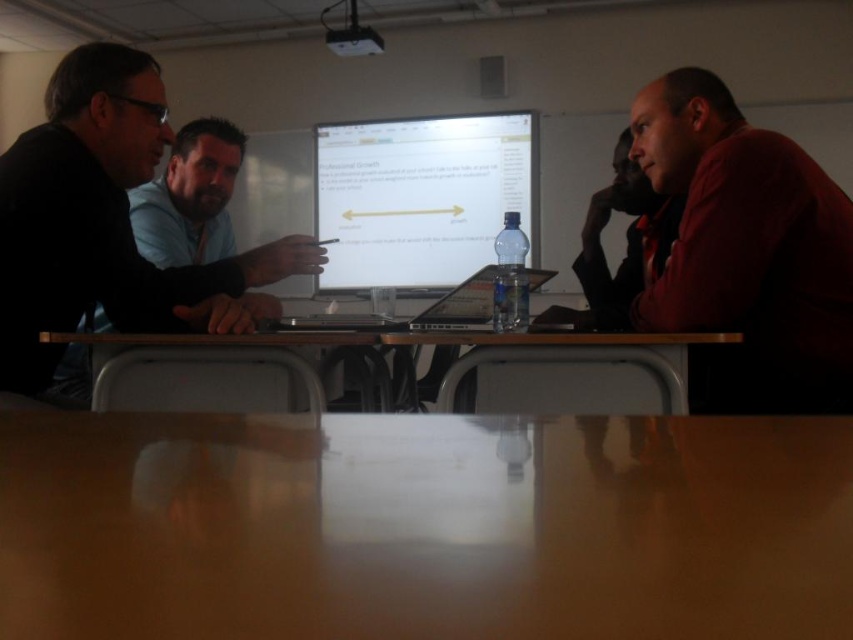
You are sitting at the table and want to reach both the white glossy computer monitor at center and the black plastic laptop at center. Which one is closer to your left side?

The white glossy computer monitor at center is to the left of the black plastic laptop at center, so it is closer to your left side.

Based on the scene described, which object is taller between the white glossy computer monitor at center and the smooth wooden table at center?

The white glossy computer monitor at center is much taller than the smooth wooden table at center.

You are sitting at the smooth wooden table at center and want to place your black plastic laptop at center on the table. Based on the scene description, is the laptop already on the table?

The smooth wooden table at center is located below the black plastic laptop at center, which means the laptop is already placed on the table.